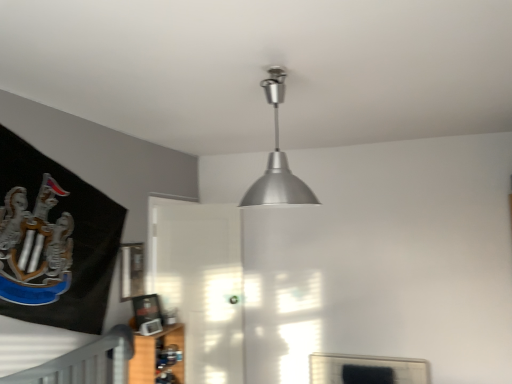
Question: From a real-world perspective, is wooden shelf at lower left positioned under transparent glass door at center based on gravity?

Choices:
 (A) no
 (B) yes

Answer: (B)

Question: Are wooden shelf at lower left and transparent glass door at center making contact?

Choices:
 (A) yes
 (B) no

Answer: (B)

Question: Is wooden shelf at lower left at the right side of transparent glass door at center?

Choices:
 (A) yes
 (B) no

Answer: (B)

Question: From a real-world perspective, is wooden shelf at lower left positioned over transparent glass door at center based on gravity?

Choices:
 (A) no
 (B) yes

Answer: (A)

Question: Is wooden shelf at lower left facing away from transparent glass door at center?

Choices:
 (A) yes
 (B) no

Answer: (B)

Question: Can you confirm if wooden shelf at lower left is shorter than transparent glass door at center?

Choices:
 (A) no
 (B) yes

Answer: (B)

Question: Is metallic silver picture frame at upper center not close to silver metallic lampshade at upper center?

Choices:
 (A) no
 (B) yes

Answer: (B)

Question: Does metallic silver picture frame at upper center have a lesser height compared to silver metallic lampshade at upper center?

Choices:
 (A) yes
 (B) no

Answer: (A)

Question: Is metallic silver picture frame at upper center to the left of silver metallic lampshade at upper center from the viewer's perspective?

Choices:
 (A) yes
 (B) no

Answer: (A)

Question: From the image's perspective, would you say metallic silver picture frame at upper center is positioned over silver metallic lampshade at upper center?

Choices:
 (A) no
 (B) yes

Answer: (A)

Question: Does metallic silver picture frame at upper center have a smaller size compared to silver metallic lampshade at upper center?

Choices:
 (A) yes
 (B) no

Answer: (A)

Question: Can you confirm if metallic silver picture frame at upper center is bigger than silver metallic lampshade at upper center?

Choices:
 (A) no
 (B) yes

Answer: (A)

Question: From the image's perspective, is silver metallic lampshade at upper center above wooden shelf at lower left?

Choices:
 (A) no
 (B) yes

Answer: (B)